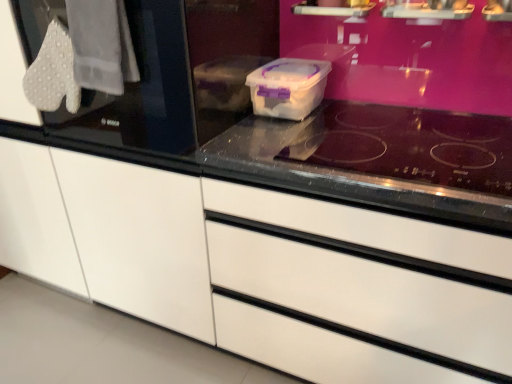
Based on the photo, in order to face transparent glass at center, should I rotate leftwards or rightwards?

To face it directly, rotate right by 19.183 degrees.

Where is `white textured gloves at upper left`? Image resolution: width=512 pixels, height=384 pixels. white textured gloves at upper left is located at coordinates (101, 45).

Locate an element on the screen. transparent glass at center is located at coordinates (409, 146).

Considering the sizes of transparent plastic container at center and transparent glass at center in the image, is transparent plastic container at center wider or thinner than transparent glass at center?

Clearly, transparent plastic container at center has less width compared to transparent glass at center.

Is transparent plastic container at center taller or shorter than transparent glass at center?

transparent plastic container at center is taller than transparent glass at center.

Is transparent plastic container at center positioned with its back to transparent glass at center?

transparent plastic container at center is not turned away from transparent glass at center.

Is point (506, 138) closer to camera compared to point (325, 273)?

No, it is behind (325, 273).

Considering the sizes of objects transparent glass at center and white glossy drawer at center in the image provided, who is thinner, transparent glass at center or white glossy drawer at center?

transparent glass at center is thinner.

From the picture: Is the depth of transparent glass at center less than that of white glossy drawer at center?

That is False.

Would you say transparent glass at center is outside white glossy drawer at center?

That's incorrect, transparent glass at center is not completely outside white glossy drawer at center.

Is transparent plastic container at center far from transparent glass door at left?

No, there isn't a large distance between transparent plastic container at center and transparent glass door at left.

Is point (302, 68) less distant than point (64, 121)?

No, (302, 68) is further to viewer.

From a real-world perspective, between transparent plastic container at center and transparent glass door at left, who is vertically higher?

transparent glass door at left.

Is transparent plastic container at center not within transparent glass door at left?

Indeed, transparent plastic container at center is completely outside transparent glass door at left.

Do you think transparent plastic container at center is within white glossy drawer at center, or outside of it?

transparent plastic container at center lies outside white glossy drawer at center.

In the image, is transparent plastic container at center on the left side or the right side of white glossy drawer at center?

transparent plastic container at center is positioned on white glossy drawer at center's left side.

From a real-world perspective, who is located higher, transparent plastic container at center or white glossy drawer at center?

transparent plastic container at center is physically above.

Who is bigger, transparent plastic container at center or white glossy drawer at center?

white glossy drawer at center is bigger.

How many degrees apart are the facing directions of transparent glass door at left and transparent glass at center?

The facing directions of transparent glass door at left and transparent glass at center are 0.662 degrees apart.

Is transparent glass door at left thinner than transparent glass at center?

No, transparent glass door at left is not thinner than transparent glass at center.

From the image's perspective, is transparent glass door at left positioned above or below transparent glass at center?

Clearly, from the image's perspective, transparent glass door at left is above transparent glass at center.

Is transparent glass door at left further to camera compared to white textured gloves at upper left?

No, it is in front of white textured gloves at upper left.

Is point (85, 116) in front of point (111, 87)?

No, (85, 116) is behind (111, 87).

From the image's perspective, is transparent glass door at left located beneath white textured gloves at upper left?

Actually, transparent glass door at left appears above white textured gloves at upper left in the image.

From a real-world perspective, is transparent glass door at left physically located above or below white textured gloves at upper left?

From a real-world perspective, transparent glass door at left is physically below white textured gloves at upper left.

Between white textured gloves at upper left and transparent glass at center, which one appears on the right side from the viewer's perspective?

transparent glass at center is more to the right.

Considering the points (82, 73) and (356, 166), which point is in front, point (82, 73) or point (356, 166)?

The point (356, 166) is in front.

Is white textured gloves at upper left placed right next to transparent glass at center?

No.

Is white textured gloves at upper left wider than transparent glass at center?

No.

Identify the location of gas stove directly beneath the transparent plastic container at center (from a real-world perspective). (409, 146).

Where is `gas stove to the left of white glossy drawer at center`? This screenshot has height=384, width=512. gas stove to the left of white glossy drawer at center is located at coordinates (409, 146).

Estimate the real-world distances between objects in this image. Which object is further from white textured gloves at upper left, white glossy drawer at center or transparent glass at center?

white glossy drawer at center lies further to white textured gloves at upper left than the other object.

From the image, which object appears to be nearer to transparent glass door at left, white textured gloves at upper left or white glossy drawer at center?

Among the two, white textured gloves at upper left is located nearer to transparent glass door at left.

From the picture: Estimate the real-world distances between objects in this image. Which object is closer to transparent glass at center, white glossy drawer at center or transparent plastic container at center?

Based on the image, transparent plastic container at center appears to be nearer to transparent glass at center.

Looking at the image, which one is located further to transparent glass door at left, transparent glass at center or white glossy drawer at center?

transparent glass at center is further to transparent glass door at left.

Based on their spatial positions, is white textured gloves at upper left or transparent plastic container at center further from transparent glass door at left?

Among the two, transparent plastic container at center is located further to transparent glass door at left.

Looking at the image, which one is located further to white textured gloves at upper left, transparent plastic container at center or white glossy drawer at center?

white glossy drawer at center lies further to white textured gloves at upper left than the other object.

From the image, which object appears to be nearer to transparent glass at center, transparent glass door at left or transparent plastic container at center?

Among the two, transparent plastic container at center is located nearer to transparent glass at center.

Which object lies nearer to the anchor point white textured gloves at upper left, white glossy drawer at center or transparent glass door at left?

Among the two, transparent glass door at left is located nearer to white textured gloves at upper left.

This screenshot has width=512, height=384. What are the coordinates of `glass door between white textured gloves at upper left and white glossy drawer at center in the horizontal direction` in the screenshot? It's located at (141, 90).

Locate an element on the screen. appliance between transparent glass door at left and white glossy drawer at center in the horizontal direction is located at coordinates (288, 87).

At what (x,y) coordinates should I click in order to perform the action: click on appliance situated between white textured gloves at upper left and transparent glass at center from left to right. Please return your answer as a coordinate pair (x, y). Looking at the image, I should click on (288, 87).

The width and height of the screenshot is (512, 384). I want to click on glass door between white textured gloves at upper left and transparent glass at center from left to right, so click(x=141, y=90).